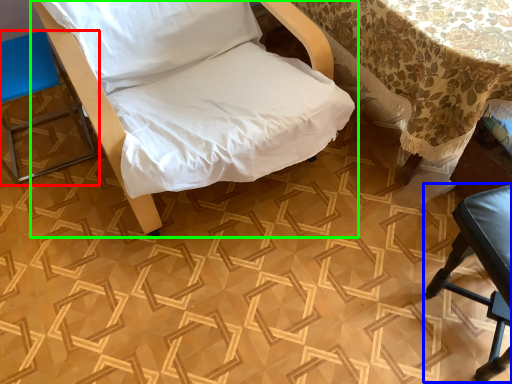
Question: Based on their relative distances, which object is farther from furniture (highlighted by a red box)? Choose from furniture (highlighted by a blue box) and furniture (highlighted by a green box).

Choices:
 (A) furniture
 (B) furniture

Answer: (A)